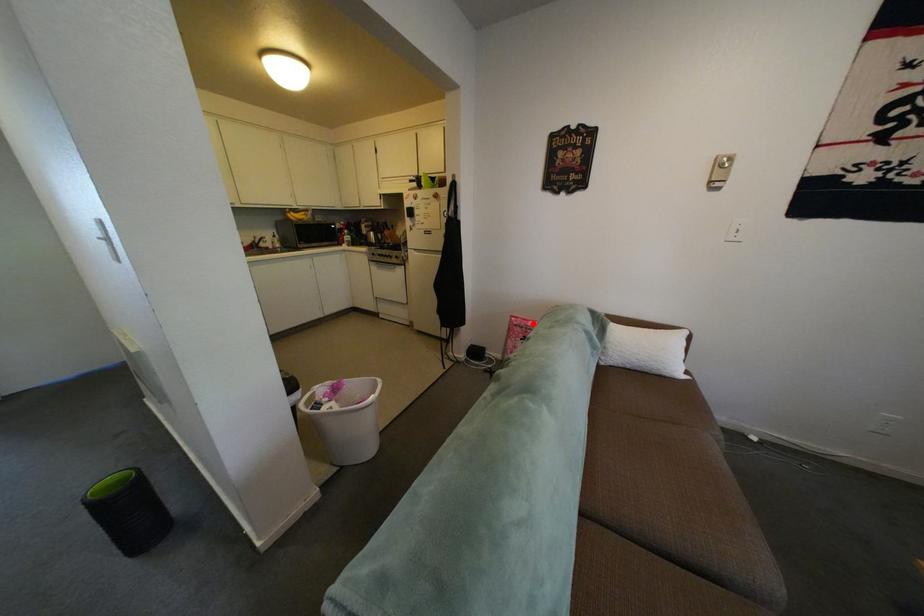
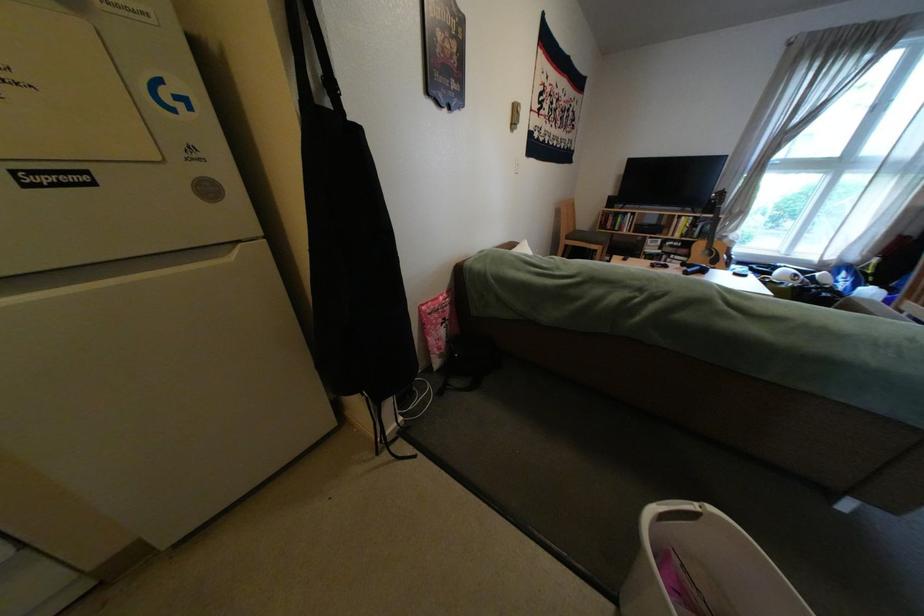
Question: I am providing you with two images of the same scene from different viewpoints. A red point is shown in image1. For the corresponding object point in image2, is it positioned nearer or farther from the camera?

Choices:
 (A) Nearer
 (B) Farther

Answer: (A)